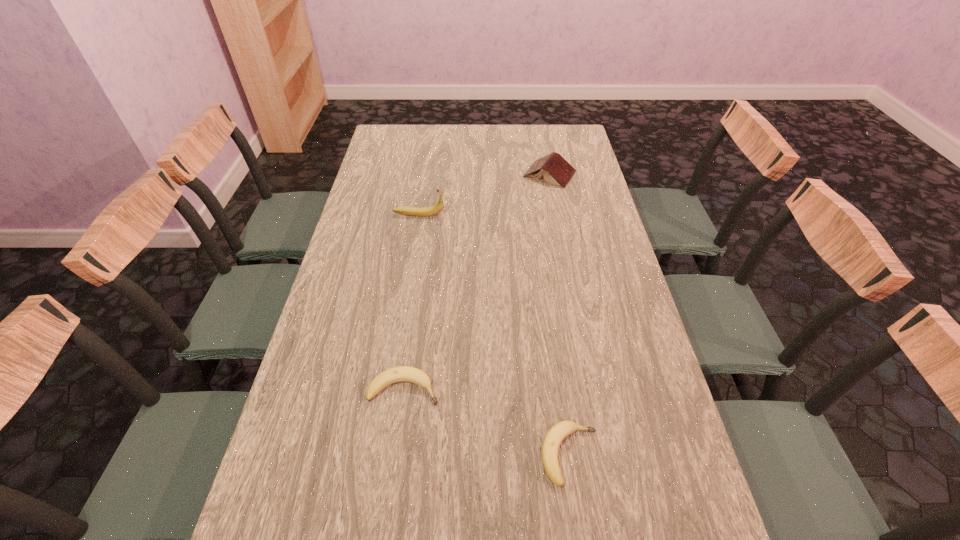
Where is `the second closest banana to the third shortest object`? This screenshot has height=540, width=960. the second closest banana to the third shortest object is located at coordinates (401, 373).

The width and height of the screenshot is (960, 540). Identify the location of vacant region that satisfies the following two spatial constraints: 1. on the back side of the rightmost banana; 2. at the stem of the farthest banana. (536, 214).

You are a GUI agent. You are given a task and a screenshot of the screen. Output one action in this format:
    pyautogui.click(x=<x>, y=<y>)
    Task: Click on the vacant space that satisfies the following two spatial constraints: 1. at the stem of the third nearest object; 2. on the back side of the rightmost banana
    Image resolution: width=960 pixels, height=540 pixels.
    Given the screenshot: What is the action you would take?
    pyautogui.click(x=382, y=455)

Identify the location of vacant space that satisfies the following two spatial constraints: 1. at the stem of the third nearest object; 2. on the left side of the rightmost banana. (382, 455).

Find the location of a particular element. This screenshot has height=540, width=960. free space that satisfies the following two spatial constraints: 1. on the back side of the book; 2. on the right side of the rightmost banana is located at coordinates (530, 174).

Locate an element on the screen. blank area in the image that satisfies the following two spatial constraints: 1. on the front side of the farthest object; 2. at the stem of the second nearest object is located at coordinates (591, 389).

The image size is (960, 540). Identify the location of vacant space that satisfies the following two spatial constraints: 1. at the stem of the nearest object; 2. on the left side of the tallest object. (382, 455).

Where is `vacant area in the image that satisfies the following two spatial constraints: 1. at the stem of the nearest banana; 2. on the left side of the tallest object`? The width and height of the screenshot is (960, 540). vacant area in the image that satisfies the following two spatial constraints: 1. at the stem of the nearest banana; 2. on the left side of the tallest object is located at coordinates (382, 455).

In order to click on free space that satisfies the following two spatial constraints: 1. at the stem of the second nearest banana; 2. on the left side of the rightmost banana in this screenshot , I will do 396,455.

Identify the location of free region that satisfies the following two spatial constraints: 1. at the stem of the nearest object; 2. on the right side of the second nearest object. (396, 455).